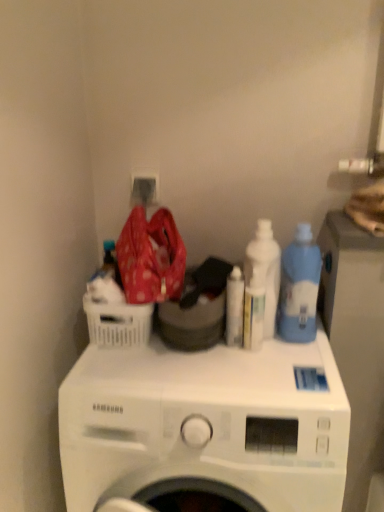
Where is `free location to the right of white plastic bottle at center`? This screenshot has height=512, width=384. free location to the right of white plastic bottle at center is located at coordinates (298, 352).